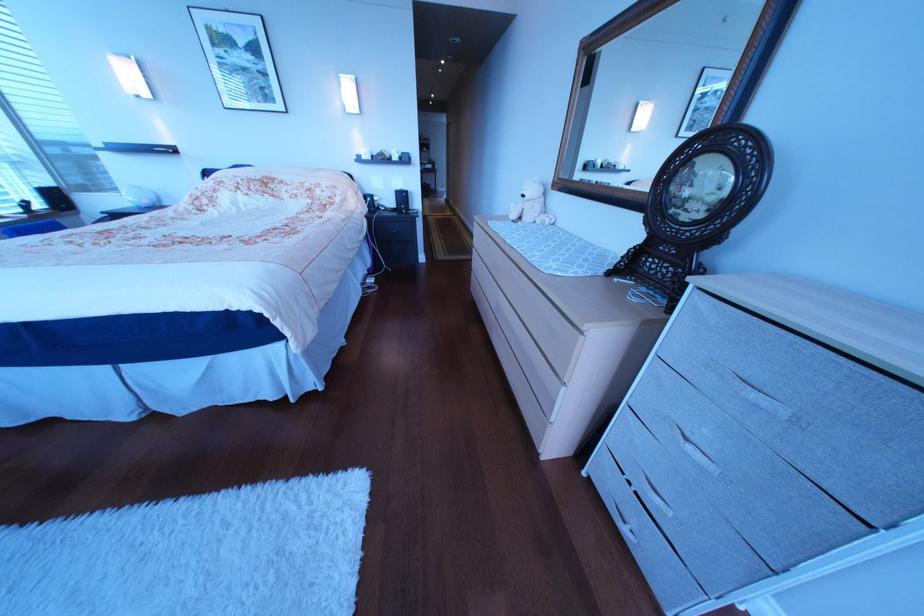
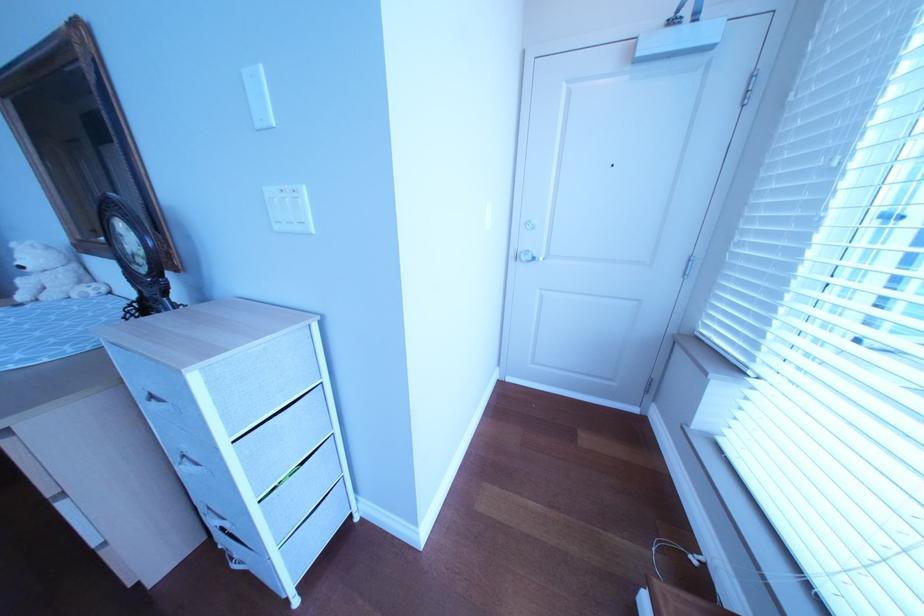
Where in the second image is the point corresponding to point 539,198 from the first image?

(37, 270)